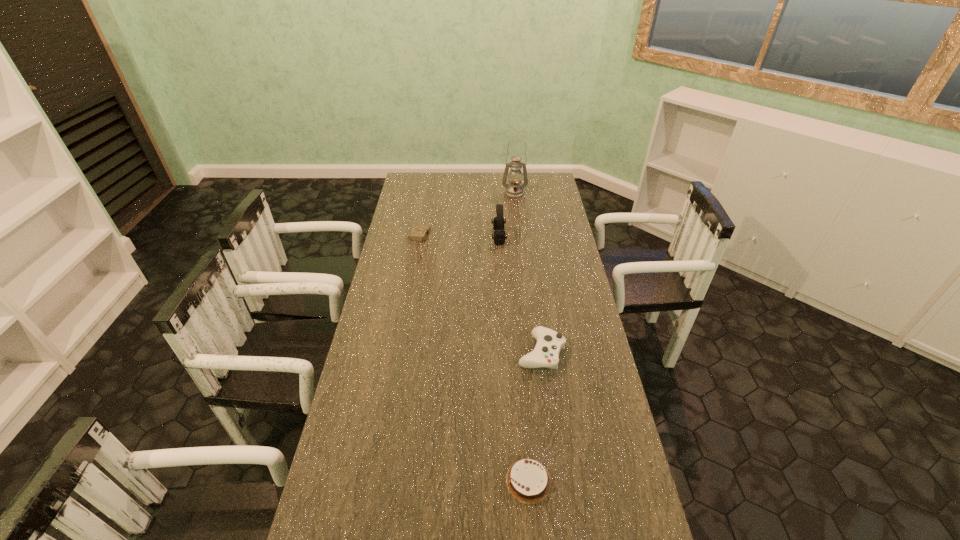
Locate an element on the screen. The image size is (960, 540). vacant point located on the headband of the headset is located at coordinates (435, 237).

At what (x,y) coordinates should I click in order to perform the action: click on vacant space located on the right of the second nearest object. Please return your answer as a coordinate pair (x, y). The width and height of the screenshot is (960, 540). Looking at the image, I should click on [584, 353].

The height and width of the screenshot is (540, 960). Identify the location of vacant point located on the front of the diary. (411, 286).

You are a GUI agent. You are given a task and a screenshot of the screen. Output one action in this format:
    pyautogui.click(x=<x>, y=<y>)
    Task: Click on the vacant area situated 0.370m on the back of the nearest object
    The image size is (960, 540).
    Given the screenshot: What is the action you would take?
    pyautogui.click(x=518, y=351)

This screenshot has height=540, width=960. I want to click on object at the far edge, so click(514, 190).

I want to click on object at the left edge, so click(x=419, y=232).

Where is `oil lamp that is positioned at the right edge`? The image size is (960, 540). oil lamp that is positioned at the right edge is located at coordinates (514, 190).

The height and width of the screenshot is (540, 960). In order to click on control that is at the right edge in this screenshot , I will do `click(549, 343)`.

Where is `object that is positioned at the far right corner`? The width and height of the screenshot is (960, 540). object that is positioned at the far right corner is located at coordinates (514, 190).

The image size is (960, 540). Identify the location of vacant space at the far edge of the desktop. (498, 193).